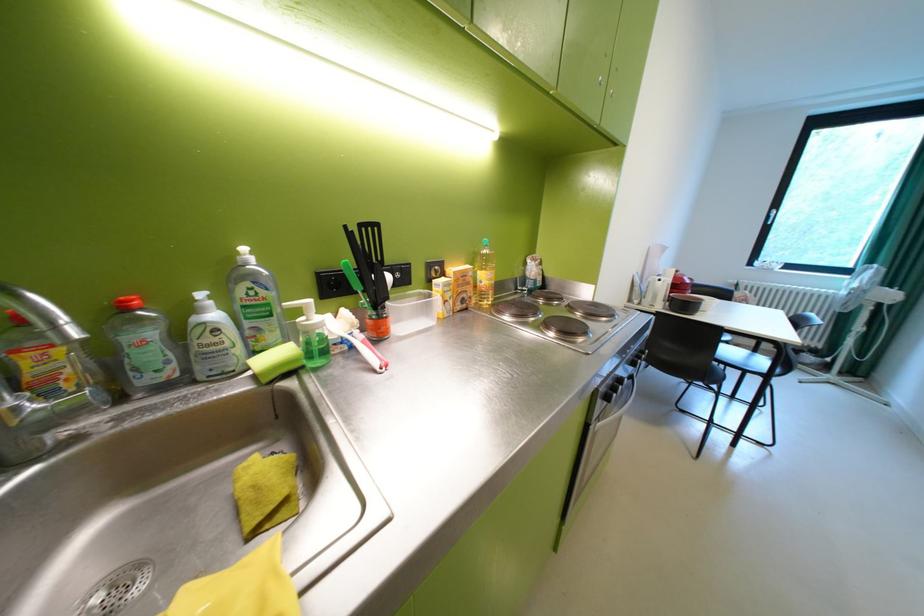
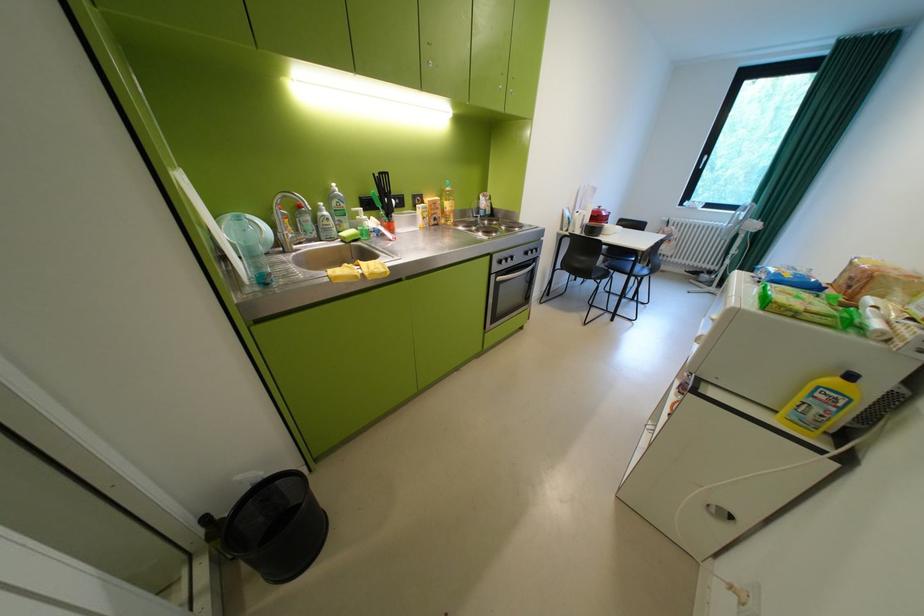
Find the pixel in the second image that matches point 225,331 in the first image.

(338, 220)